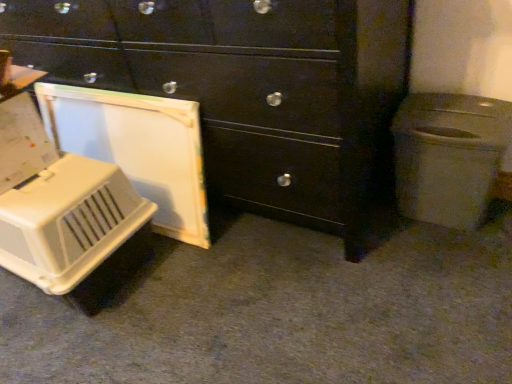
Question: Is white plastic trash can at right facing towards white plastic pet carrier at lower left?

Choices:
 (A) no
 (B) yes

Answer: (A)

Question: Are white plastic trash can at right and white plastic pet carrier at lower left beside each other?

Choices:
 (A) no
 (B) yes

Answer: (A)

Question: Are white plastic trash can at right and white plastic pet carrier at lower left located far from each other?

Choices:
 (A) no
 (B) yes

Answer: (A)

Question: Is white plastic trash can at right bigger than white plastic pet carrier at lower left?

Choices:
 (A) yes
 (B) no

Answer: (B)

Question: Is white plastic trash can at right to the left of white plastic pet carrier at lower left from the viewer's perspective?

Choices:
 (A) no
 (B) yes

Answer: (A)

Question: From a real-world perspective, relative to white plastic pet carrier at lower left, is matte black chest of drawers at center vertically above or below?

Choices:
 (A) above
 (B) below

Answer: (A)

Question: Is point (123, 1) closer or farther from the camera than point (27, 208)?

Choices:
 (A) closer
 (B) farther

Answer: (B)

Question: Considering the positions of matte black chest of drawers at center and white plastic pet carrier at lower left in the image, is matte black chest of drawers at center taller or shorter than white plastic pet carrier at lower left?

Choices:
 (A) tall
 (B) short

Answer: (A)

Question: Considering the positions of matte black chest of drawers at center and white plastic pet carrier at lower left in the image, is matte black chest of drawers at center wider or thinner than white plastic pet carrier at lower left?

Choices:
 (A) thin
 (B) wide

Answer: (B)

Question: From a real-world perspective, is white plastic trash can at right physically located above or below white plastic pet carrier at lower left?

Choices:
 (A) below
 (B) above

Answer: (B)

Question: From the image's perspective, relative to white plastic pet carrier at lower left, is white plastic trash can at right above or below?

Choices:
 (A) below
 (B) above

Answer: (B)

Question: Considering the positions of white plastic trash can at right and white plastic pet carrier at lower left in the image, is white plastic trash can at right bigger or smaller than white plastic pet carrier at lower left?

Choices:
 (A) big
 (B) small

Answer: (B)

Question: In terms of width, does white plastic trash can at right look wider or thinner when compared to white plastic pet carrier at lower left?

Choices:
 (A) thin
 (B) wide

Answer: (A)

Question: Would you say white plastic pet carrier at lower left is to the left or to the right of white plastic trash can at right in the picture?

Choices:
 (A) right
 (B) left

Answer: (B)

Question: From their relative heights in the image, would you say white plastic pet carrier at lower left is taller or shorter than white plastic trash can at right?

Choices:
 (A) short
 (B) tall

Answer: (A)